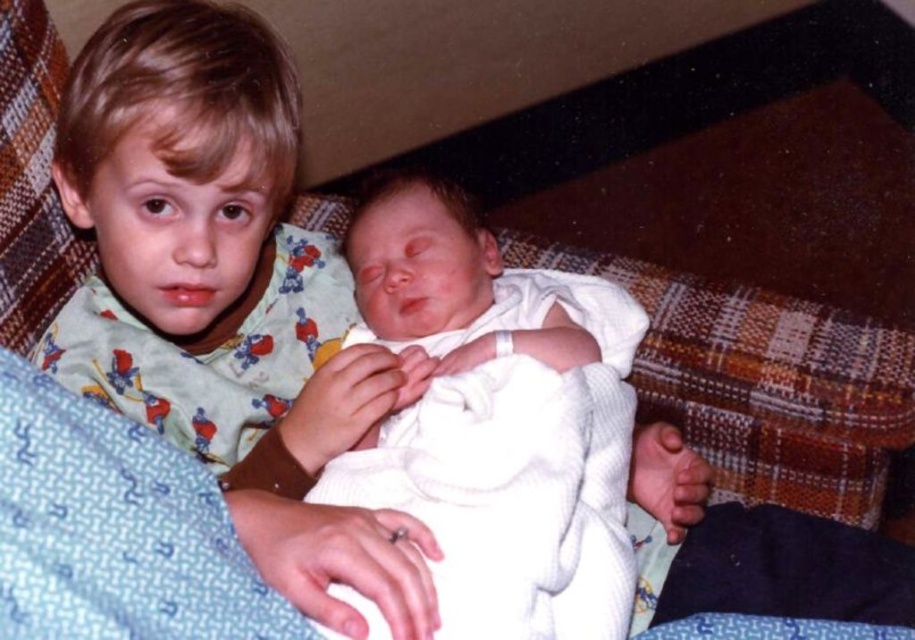
You are a photographer trying to capture a closeup of the white knit baby at center without the light green pajamas at upper left blocking the view. Is this possible given their positions?

The light green pajamas at upper left are closer to you than the white knit baby at center, so they will block the view of the white knit baby at center. You need to move the light green pajamas at upper left or adjust your angle to avoid the obstruction.

Based on the photo, you are a photographer trying to capture the sleeping baby in the younger child. You want to ensure the baby is centered in the photo. The camera has a focus point at point (202, 246). Is the focus point positioned correctly to center the baby?

The point (202, 246) marks light green pajamas at upper left, which are not the baby. Therefore, the focus point is not correctly positioned to center the baby.

Based on the photo, you are a photographer trying to capture a closeup of the light green pajamas at upper left and the white knit baby at center. Since you want to focus on both, which object should you adjust your camera to prioritize in terms of size?

The light green pajamas at upper left has a lesser width compared to the white knit baby at center, so you should prioritize focusing on the white knit baby at center to ensure it is in clear view while still including the light green pajamas at upper left in the frame.